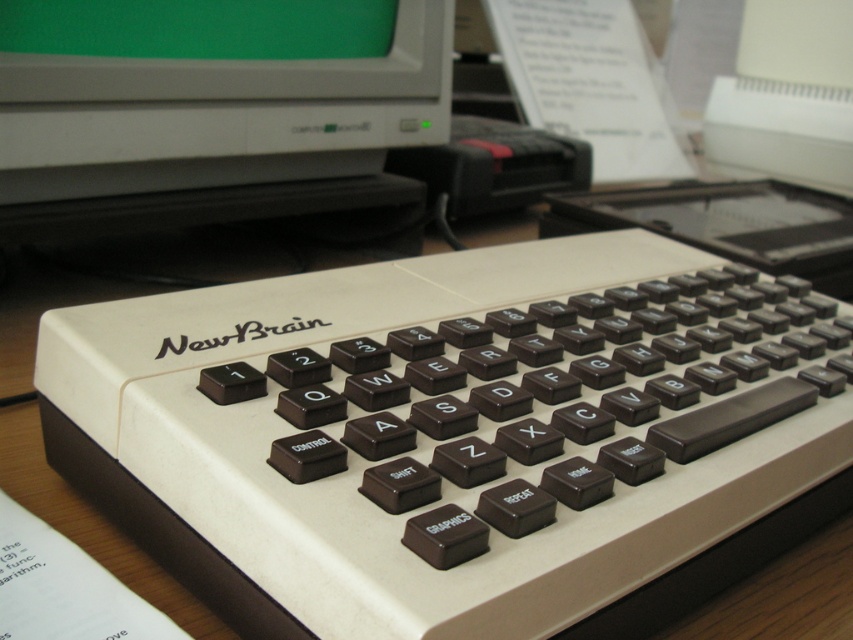
Question: Among these points, which one is nearest to the camera?

Choices:
 (A) (15, 324)
 (B) (206, 29)

Answer: (A)

Question: Which of the following is the closest to the observer?

Choices:
 (A) white plastic keyboard at center
 (B) green matte monitor at upper center

Answer: (A)

Question: Can you confirm if green matte monitor at upper center is wider than white plastic keyboard at center?

Choices:
 (A) yes
 (B) no

Answer: (B)

Question: Is green matte monitor at upper center further to camera compared to white plastic keyboard at center?

Choices:
 (A) yes
 (B) no

Answer: (A)

Question: In this image, where is green matte monitor at upper center located relative to white plastic keyboard at center?

Choices:
 (A) below
 (B) above

Answer: (B)